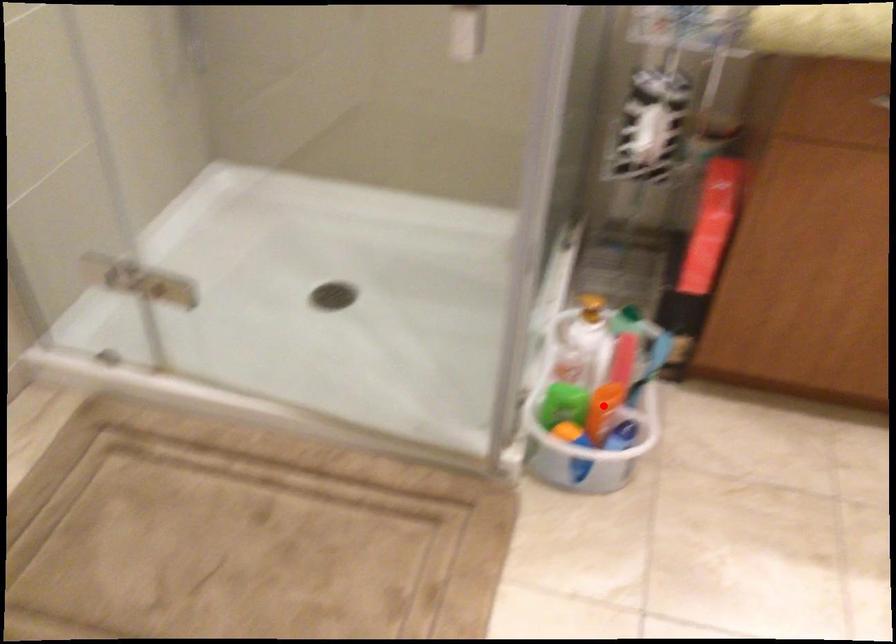
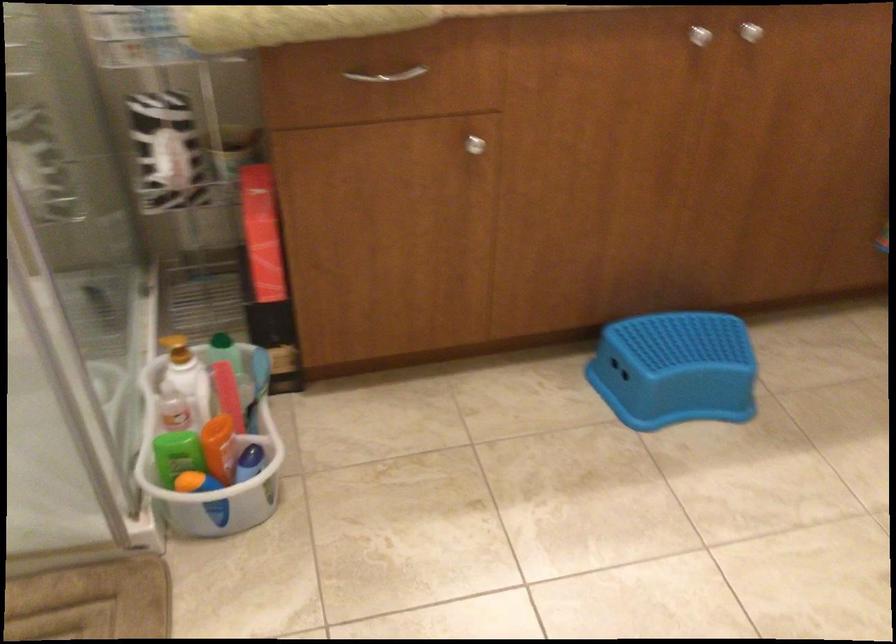
Locate, in the second image, the point that corresponds to the highlighted location in the first image.

(220, 448)